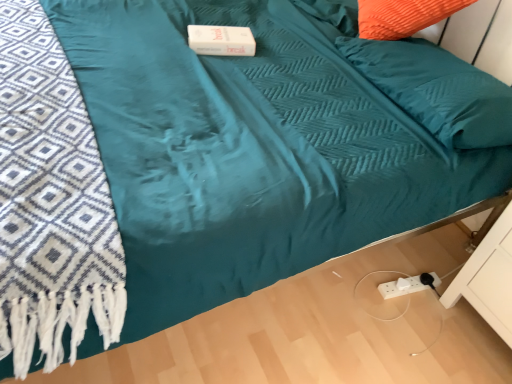
Question: Would you say white matte drawer at lower right is to the left or to the right of teal fabric pillow at upper right in the picture?

Choices:
 (A) right
 (B) left

Answer: (A)

Question: Considering their positions, is white matte drawer at lower right located in front of or behind teal fabric pillow at upper right?

Choices:
 (A) behind
 (B) front

Answer: (B)

Question: Considering the positions of white matte drawer at lower right and teal fabric pillow at upper right in the image, is white matte drawer at lower right bigger or smaller than teal fabric pillow at upper right?

Choices:
 (A) small
 (B) big

Answer: (B)

Question: Looking at the image, does teal fabric pillow at upper right seem bigger or smaller compared to white matte drawer at lower right?

Choices:
 (A) small
 (B) big

Answer: (A)

Question: Considering the positions of teal fabric pillow at upper right and white matte drawer at lower right in the image, is teal fabric pillow at upper right taller or shorter than white matte drawer at lower right?

Choices:
 (A) tall
 (B) short

Answer: (B)

Question: Considering their positions, is teal fabric pillow at upper right located in front of or behind white matte drawer at lower right?

Choices:
 (A) front
 (B) behind

Answer: (B)

Question: Does point (449, 69) appear closer or farther from the camera than point (477, 301)?

Choices:
 (A) closer
 (B) farther

Answer: (A)